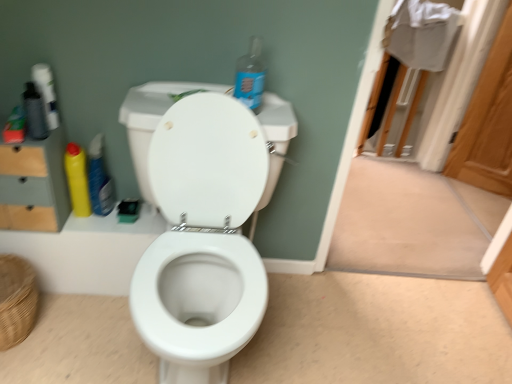
Locate an element on the screen. empty space that is to the right of yellow plastic bottle at left, marked as the 2th cleaning product in a right-to-left arrangement is located at coordinates (135, 221).